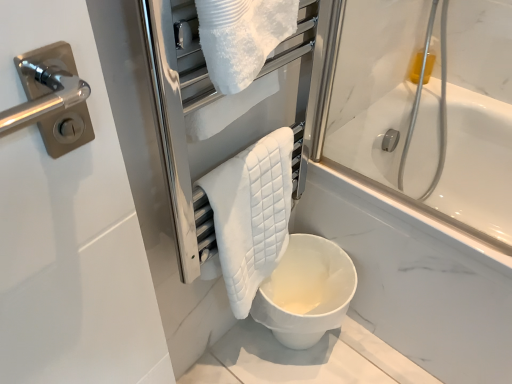
Question: Is white quilted towel at center not inside white matte toilet at lower center?

Choices:
 (A) yes
 (B) no

Answer: (A)

Question: Is white quilted towel at center to the right of white matte toilet at lower center from the viewer's perspective?

Choices:
 (A) no
 (B) yes

Answer: (A)

Question: Does white quilted towel at center touch white matte toilet at lower center?

Choices:
 (A) yes
 (B) no

Answer: (B)

Question: From a real-world perspective, is white quilted towel at center located beneath white matte toilet at lower center?

Choices:
 (A) yes
 (B) no

Answer: (B)

Question: Does white quilted towel at center come behind white matte toilet at lower center?

Choices:
 (A) yes
 (B) no

Answer: (B)

Question: Can you confirm if white quilted towel at center is shorter than white matte toilet at lower center?

Choices:
 (A) yes
 (B) no

Answer: (B)

Question: Is white quilted towel at center directly adjacent to white quilted towel at center?

Choices:
 (A) yes
 (B) no

Answer: (B)

Question: Considering the relative sizes of white quilted towel at center and white quilted towel at center in the image provided, is white quilted towel at center taller than white quilted towel at center?

Choices:
 (A) no
 (B) yes

Answer: (A)

Question: Can you confirm if white quilted towel at center is shorter than white quilted towel at center?

Choices:
 (A) yes
 (B) no

Answer: (A)

Question: Is white quilted towel at center located outside white quilted towel at center?

Choices:
 (A) yes
 (B) no

Answer: (B)

Question: Is white quilted towel at center thinner than white quilted towel at center?

Choices:
 (A) no
 (B) yes

Answer: (B)

Question: Does white quilted towel at center come in front of white quilted towel at center?

Choices:
 (A) yes
 (B) no

Answer: (B)

Question: Is white quilted towel at center in front of white quilted towel at center?

Choices:
 (A) yes
 (B) no

Answer: (A)